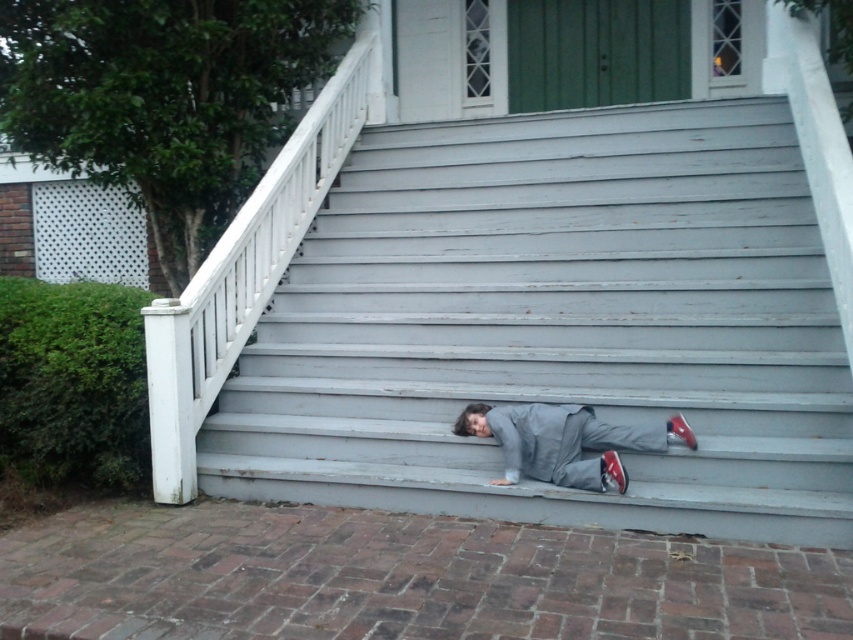
Question: Is gray matte jacket at lower center smaller than shiny red sneaker at lower right?

Choices:
 (A) yes
 (B) no

Answer: (B)

Question: Based on their relative distances, which object is farther from the gray matte jacket at lower center?

Choices:
 (A) shiny red shoe at lower right
 (B) shiny red sneaker at lower right
 (C) smooth gray stairs at center

Answer: (C)

Question: Is the position of smooth gray stairs at center less distant than that of shiny red shoe at lower right?

Choices:
 (A) no
 (B) yes

Answer: (B)

Question: Can you confirm if smooth gray stairs at center is positioned to the right of shiny red shoe at lower right?

Choices:
 (A) no
 (B) yes

Answer: (A)

Question: Among these objects, which one is nearest to the camera?

Choices:
 (A) shiny red shoe at lower right
 (B) gray matte jacket at lower center

Answer: (B)

Question: Which of these objects is positioned closest to the shiny red sneaker at lower right?

Choices:
 (A) gray matte jacket at lower center
 (B) shiny red shoe at lower right
 (C) smooth gray stairs at center

Answer: (A)